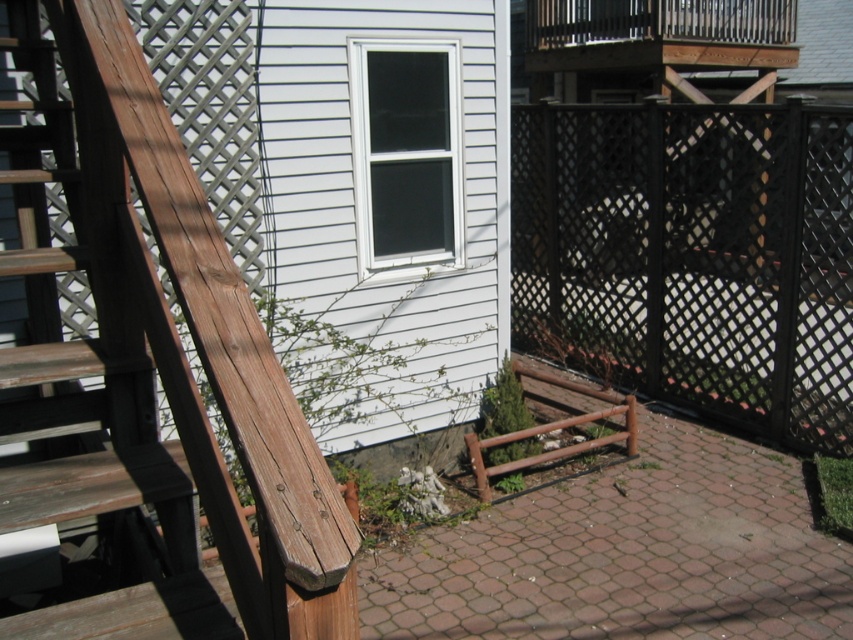
Does weathered wood ladder at left have a smaller size compared to wooden deck at center?

Incorrect, weathered wood ladder at left is not smaller in size than wooden deck at center.

Between point (85, 38) and point (483, 589), which one is positioned behind?

The point (483, 589) is more distant.

Who is more forward, (337,554) or (656,552)?

Point (337,554) is more forward.

Identify the location of weathered wood ladder at left. (154, 358).

Which of these two, black lattice fence at lower right or wooden deck at center, stands shorter?

wooden deck at center is shorter.

Measure the distance between black lattice fence at lower right and wooden deck at center.

black lattice fence at lower right is 1.34 meters away from wooden deck at center.

Is point (608, 221) in front of point (787, 604)?

No, (608, 221) is behind (787, 604).

This screenshot has width=853, height=640. Find the location of `black lattice fence at lower right`. black lattice fence at lower right is located at coordinates (692, 257).

Is point (78, 634) more distant than point (793, 225)?

No, (78, 634) is in front of (793, 225).

Who is more forward, (6, 141) or (566, 260)?

Positioned in front is point (6, 141).

The image size is (853, 640). I want to click on weathered wood ladder at left, so click(154, 358).